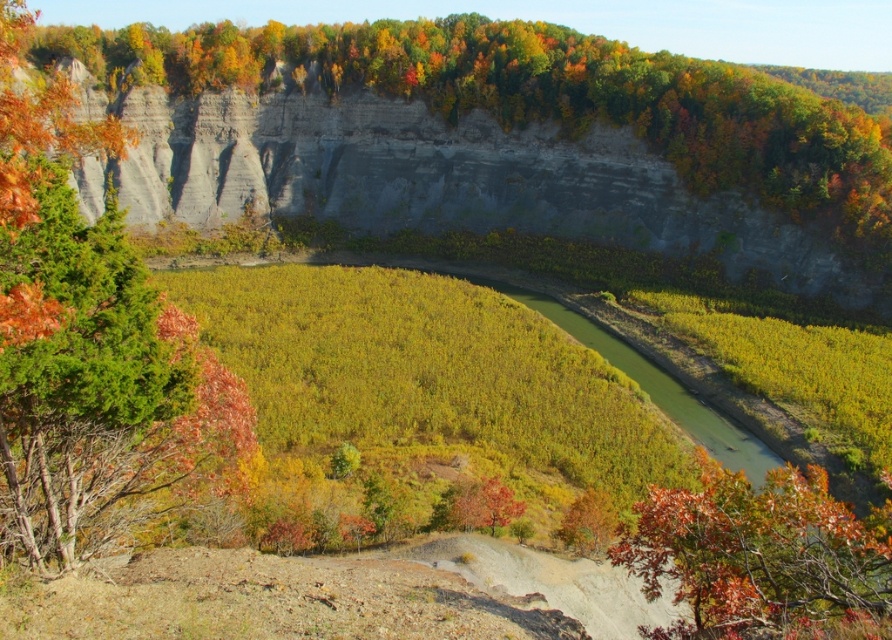
Can you confirm if green leafy tree at left is thinner than autumn leaves at lower right?

Incorrect, green leafy tree at left's width is not less than autumn leaves at lower right's.

Does green leafy tree at left appear on the left side of autumn leaves at lower right?

Indeed, green leafy tree at left is positioned on the left side of autumn leaves at lower right.

Which is behind, point (26, 241) or point (769, 484)?

Point (769, 484)

Locate an element on the screen. The height and width of the screenshot is (640, 892). green leafy tree at left is located at coordinates (87, 342).

From the picture: Is green leafy tree at left wider than smooth gray cliff face at upper center?

No, green leafy tree at left is not wider than smooth gray cliff face at upper center.

Is green leafy tree at left positioned in front of smooth gray cliff face at upper center?

Yes, it is.

Which is in front, point (139, 355) or point (699, 180)?

Point (139, 355) is more forward.

Find the location of `green leafy tree at left`. green leafy tree at left is located at coordinates (87, 342).

Between smooth gray cliff face at upper center and autumn leaves at lower right, which one is positioned higher?

smooth gray cliff face at upper center is above.

Between point (489, 93) and point (732, 534), which one is positioned in front?

Positioned in front is point (732, 534).

Image resolution: width=892 pixels, height=640 pixels. In order to click on smooth gray cliff face at upper center in this screenshot , I will do `click(546, 97)`.